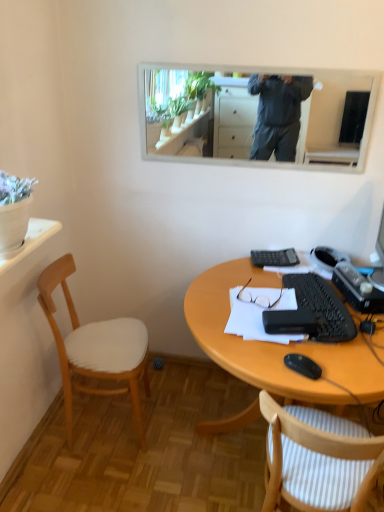
Find the location of `free point in front of black plastic mouse at lower right`. free point in front of black plastic mouse at lower right is located at coordinates (314, 384).